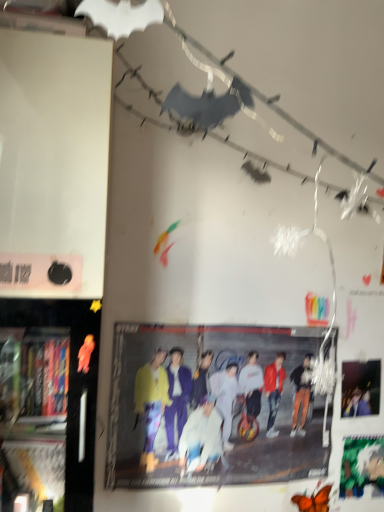
Question: Is matte black poster at upper right, the first poster page viewed from the top, in front of or behind matte yellow jacket at center in the image?

Choices:
 (A) front
 (B) behind

Answer: (B)

Question: From the image's perspective, is matte black poster at upper right, the 2th poster page when ordered from bottom to top, above or below matte yellow jacket at center?

Choices:
 (A) above
 (B) below

Answer: (A)

Question: Which of these objects is positioned closest to the matte black poster at upper right, the 2th poster page when ordered from bottom to top?

Choices:
 (A) green matte poster at lower right, which is the first poster page from bottom to top
 (B) black plastic bookshelf at left
 (C) matte yellow jacket at center

Answer: (A)

Question: Based on their relative distances, which object is farther from the green matte poster at lower right, arranged as the 2th poster page when viewed from the top?

Choices:
 (A) matte yellow jacket at center
 (B) matte black poster at upper right, the first poster page viewed from the top
 (C) black plastic bookshelf at left

Answer: (C)